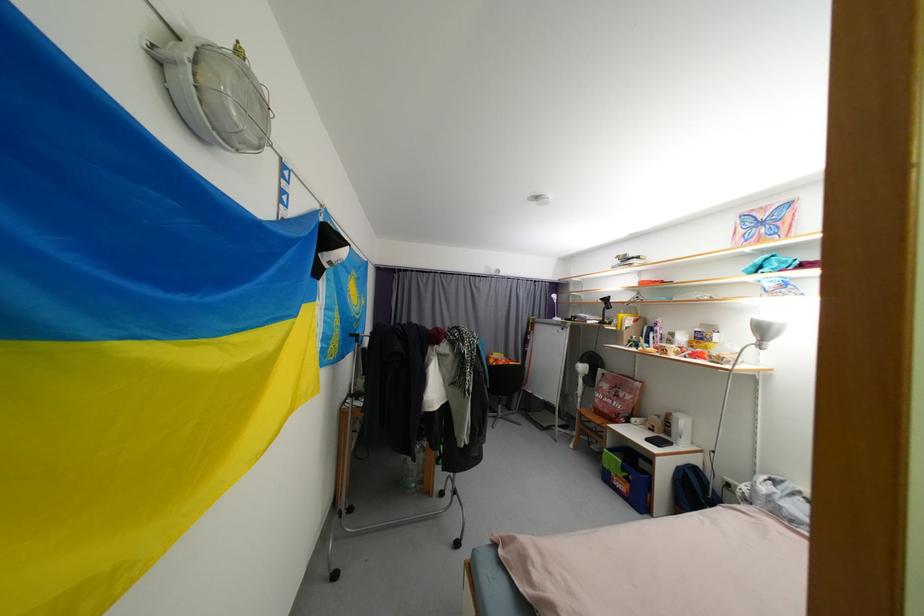
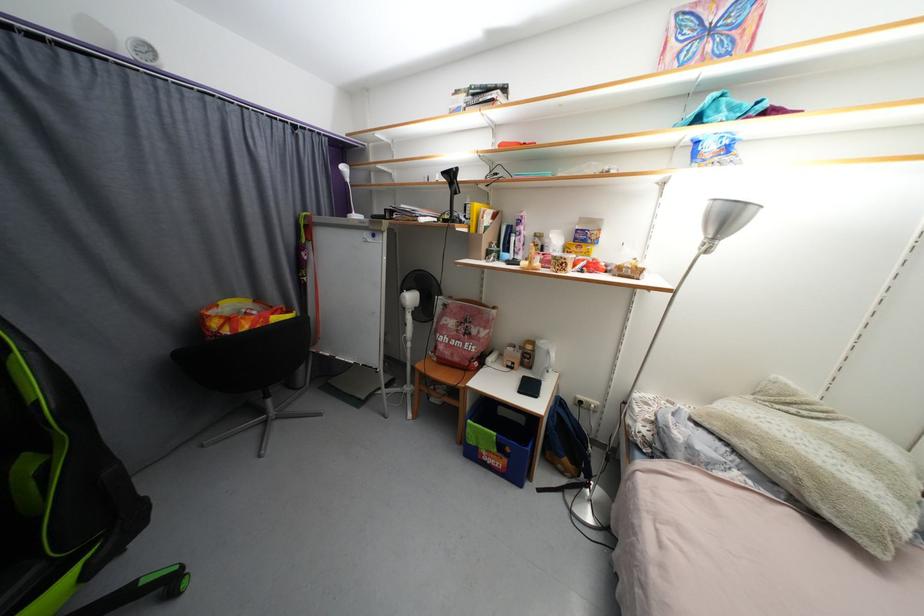
Where in the second image is the point corresponding to the point at 669,419 from the first image?

(523, 349)